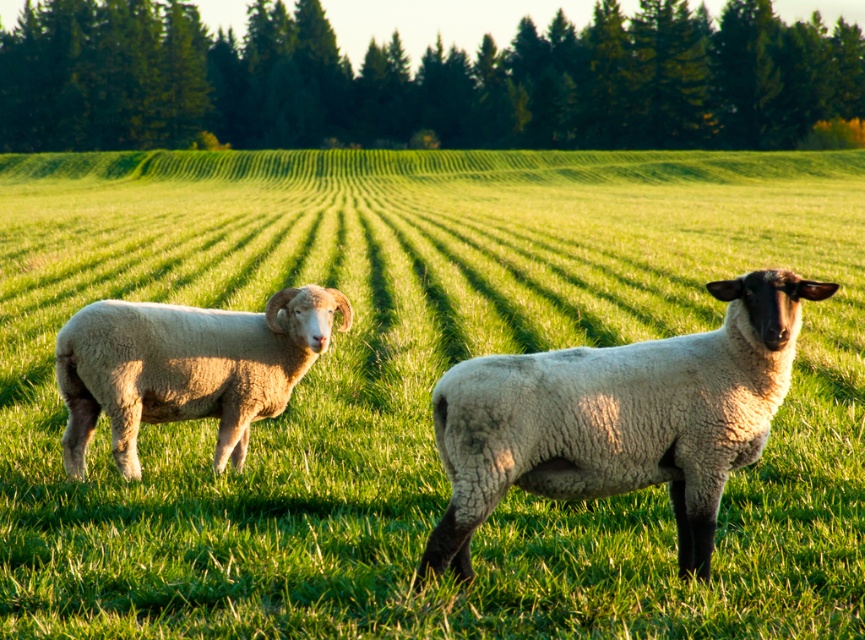
Who is lower down, white woolly sheep at center or light brown woolly ram at left?

Positioned lower is white woolly sheep at center.

The width and height of the screenshot is (865, 640). What do you see at coordinates (620, 419) in the screenshot?
I see `white woolly sheep at center` at bounding box center [620, 419].

Is point (507, 416) less distant than point (88, 385)?

Yes, point (507, 416) is closer to viewer.

Locate an element on the screen. white woolly sheep at center is located at coordinates (620, 419).